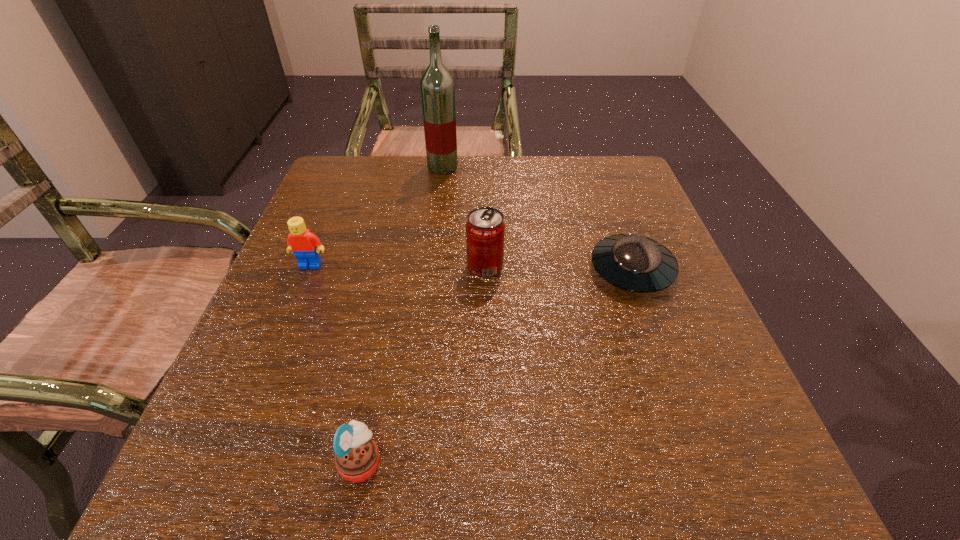
Find the location of `free space at the right edge of the desktop`. free space at the right edge of the desktop is located at coordinates (698, 343).

The width and height of the screenshot is (960, 540). What are the coordinates of `vacant space at the far left corner of the desktop` in the screenshot? It's located at (363, 206).

The image size is (960, 540). Find the location of `blank area at the near left corner`. blank area at the near left corner is located at coordinates (259, 491).

You are a GUI agent. You are given a task and a screenshot of the screen. Output one action in this format:
    pyautogui.click(x=<x>, y=<y>)
    Task: Click on the blank area at the far right corner
    
    Given the screenshot: What is the action you would take?
    pyautogui.click(x=629, y=183)

Find the location of a particular element. This screenshot has height=540, width=960. vacant region between the farthest object and the Lego is located at coordinates (376, 216).

Find the location of a particular element. blank region between the liquor and the muffin is located at coordinates (402, 314).

I want to click on empty space that is in between the farthest object and the nearest object, so 402,314.

Where is `free space between the pop soda and the leftmost object`? free space between the pop soda and the leftmost object is located at coordinates point(397,266).

In order to click on vacant space that is in between the muffin and the Lego in this screenshot , I will do `click(336, 363)`.

Locate an element on the screen. This screenshot has height=540, width=960. empty space between the saucer and the second shortest object is located at coordinates (496, 366).